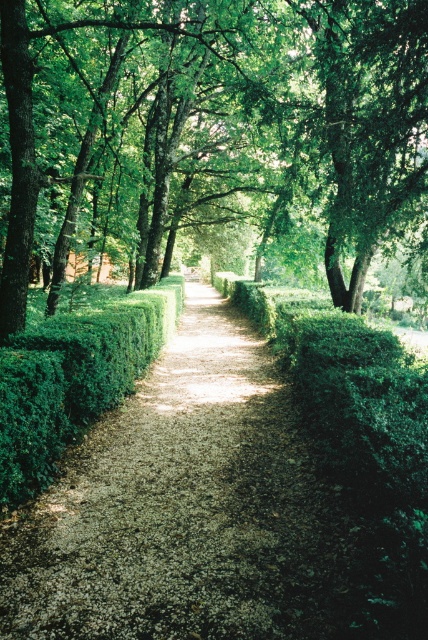
You are standing at the entrance of the garden and want to reach the green hedge at center. According to the coordinates provided, what direction should you move in to reach it?

The green hedge at center is located at coordinates point (x=181, y=508), so you should move towards the center of the image to reach it.

You are a gardener planning to trim the green hedge at center and the green leafy hedge at center. Which one requires more time to trim based on their sizes?

The green hedge at center requires more time to trim since it has a larger size compared to the green leafy hedge at center.